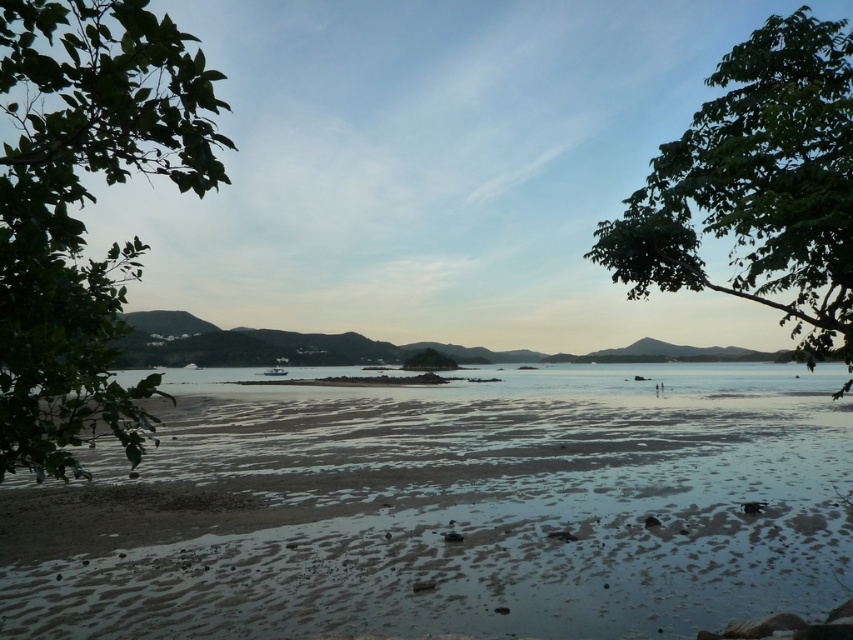
Question: Among these points, which one is nearest to the camera?

Choices:
 (A) (817, 275)
 (B) (715, 433)
 (C) (173, 33)

Answer: (C)

Question: Which of the following is the closest to the observer?

Choices:
 (A) sandy beach at lower left
 (B) green leafy tree at left
 (C) green matte island at center
 (D) green leafy tree at upper right

Answer: (B)

Question: Does green leafy tree at upper right have a greater width compared to green matte island at center?

Choices:
 (A) yes
 (B) no

Answer: (A)

Question: Does sandy beach at lower left have a greater width compared to green leafy tree at upper right?

Choices:
 (A) yes
 (B) no

Answer: (A)

Question: Which of the following is the farthest from the observer?

Choices:
 (A) green leafy tree at upper right
 (B) green leafy tree at left
 (C) green matte island at center

Answer: (C)

Question: Does green leafy tree at upper right appear under green matte island at center?

Choices:
 (A) yes
 (B) no

Answer: (B)